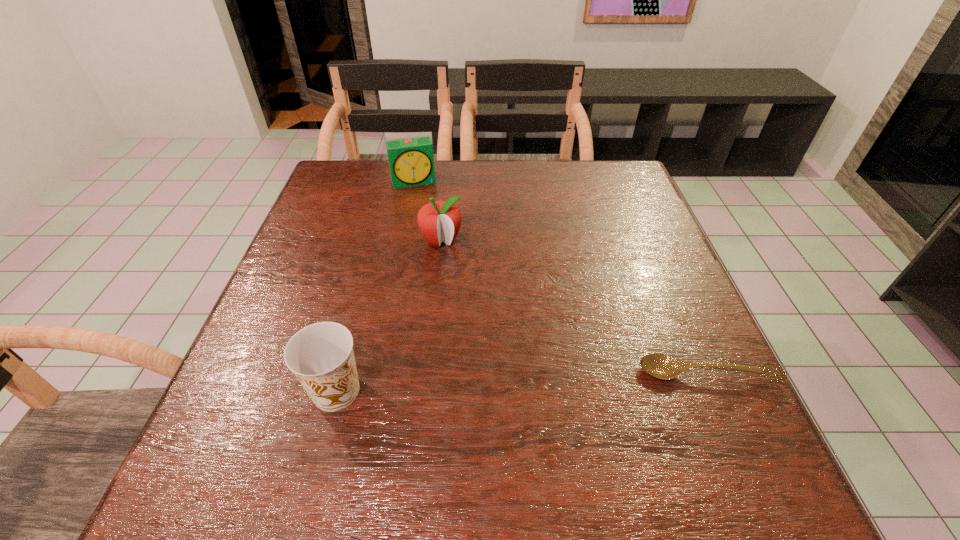
Locate an element on the screen. The image size is (960, 540). vacant space situated 0.320m on the side where a bite is taken out of the second farthest object is located at coordinates (477, 363).

In order to click on blank area located on the side where a bite is taken out of the second farthest object in this screenshot , I will do `click(474, 354)`.

What are the coordinates of `free space located 0.230m on the side where a bite is taken out of the second farthest object` in the screenshot? It's located at (467, 327).

Find the location of a particular element. This screenshot has width=960, height=540. object at the far edge is located at coordinates (411, 161).

Find the location of a particular element. This screenshot has height=540, width=960. Dixie cup located in the near edge section of the desktop is located at coordinates (321, 356).

This screenshot has height=540, width=960. I want to click on ladle present at the near edge, so click(662, 366).

This screenshot has height=540, width=960. Find the location of `object positioned at the left edge`. object positioned at the left edge is located at coordinates (321, 356).

Image resolution: width=960 pixels, height=540 pixels. I want to click on object that is positioned at the right edge, so click(x=662, y=366).

The width and height of the screenshot is (960, 540). I want to click on object that is at the near left corner, so click(x=321, y=356).

Locate an element on the screen. object at the near right corner is located at coordinates (662, 366).